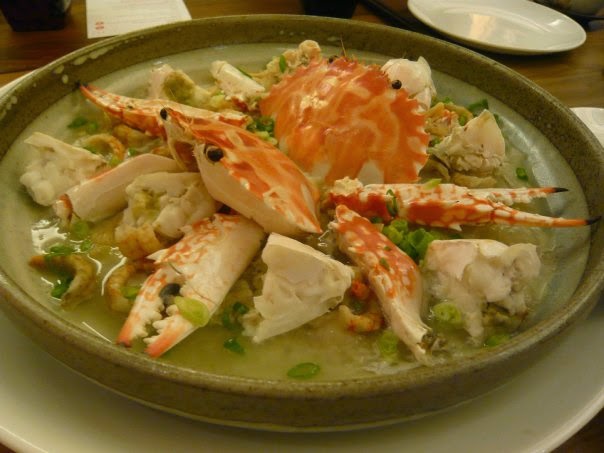
Where is `bowl`? Image resolution: width=604 pixels, height=453 pixels. bowl is located at coordinates pos(339,389).